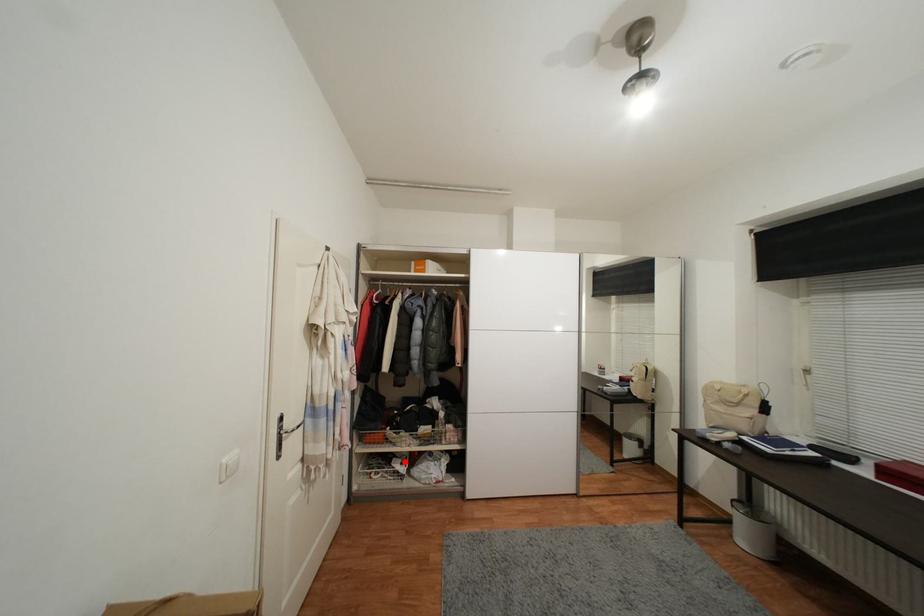
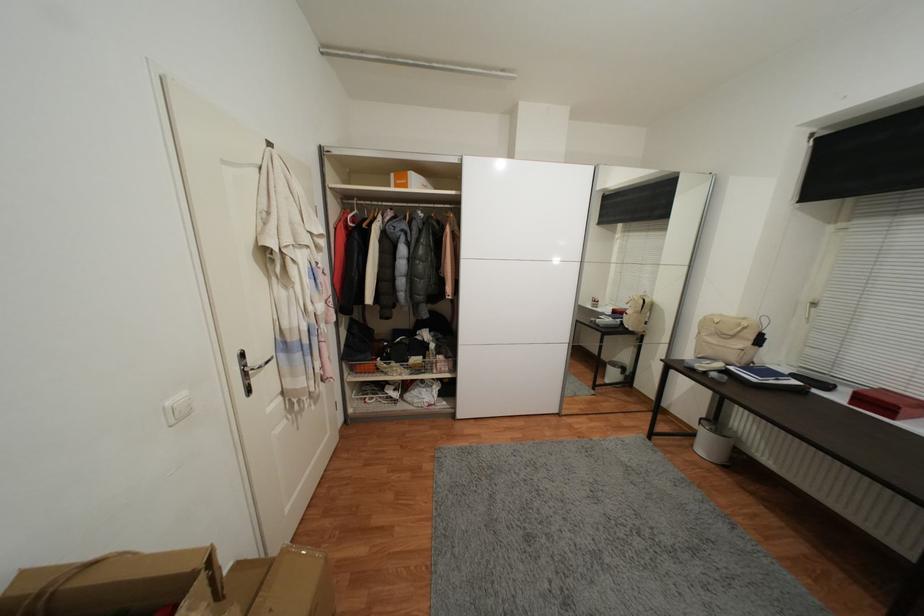
In the second image, find the point that corresponds to the highlighted location in the first image.

(397, 389)